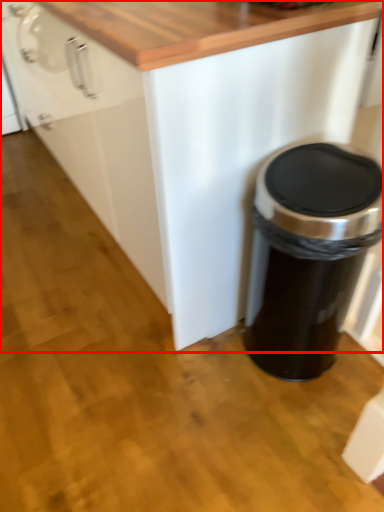
Question: From the image's perspective, considering the relative positions of cabinetry (annotated by the red box) and waste container in the image provided, where is cabinetry (annotated by the red box) located with respect to the staircase?

Choices:
 (A) below
 (B) above

Answer: (B)